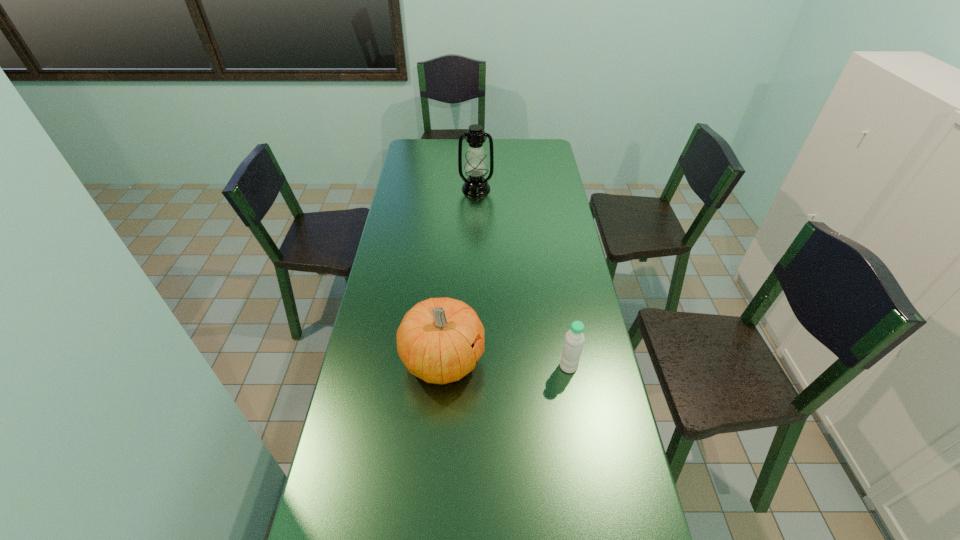
Locate an element on the screen. This screenshot has height=540, width=960. oil lamp is located at coordinates (475, 166).

Locate an element on the screen. the tallest object is located at coordinates (475, 166).

Locate an element on the screen. This screenshot has width=960, height=540. the second tallest object is located at coordinates (436, 340).

Image resolution: width=960 pixels, height=540 pixels. What are the coordinates of `the shortest object` in the screenshot? It's located at (574, 338).

Image resolution: width=960 pixels, height=540 pixels. Find the location of `the rightmost object`. the rightmost object is located at coordinates (574, 338).

What are the coordinates of `free space located 0.270m on the front of the farthest object` in the screenshot? It's located at (475, 234).

You are a GUI agent. You are given a task and a screenshot of the screen. Output one action in this format:
    pyautogui.click(x=<x>, y=<y>)
    Task: Click on the blank space located 0.070m on the front-facing side of the second tallest object
    The image size is (960, 540).
    Given the screenshot: What is the action you would take?
    pyautogui.click(x=507, y=360)

Where is `free space located 0.140m on the left of the shortest object`? Image resolution: width=960 pixels, height=540 pixels. free space located 0.140m on the left of the shortest object is located at coordinates (514, 367).

In order to click on object that is at the left edge in this screenshot , I will do `click(436, 340)`.

The height and width of the screenshot is (540, 960). Identify the location of object at the right edge. (574, 338).